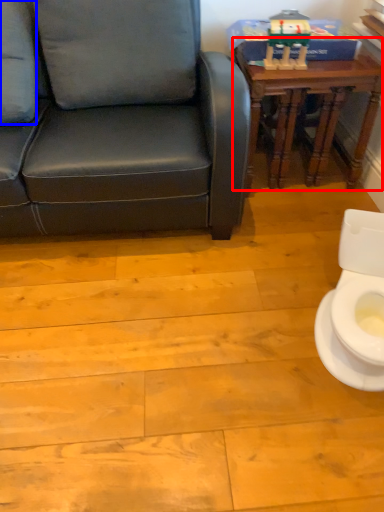
Question: Among these objects, which one is nearest to the camera, table (highlighted by a red box) or pillow (highlighted by a blue box)?

Choices:
 (A) table
 (B) pillow

Answer: (B)